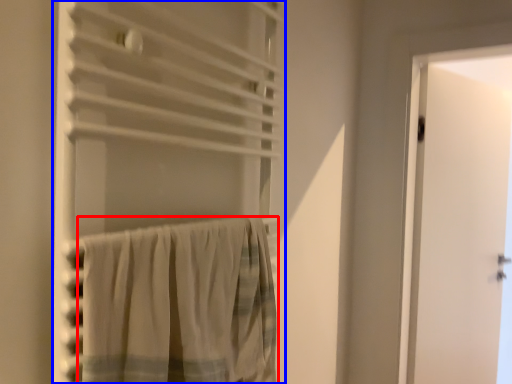
Question: Which object appears farthest to the camera in this image, curtain (highlighted by a red box) or curtain (highlighted by a blue box)?

Choices:
 (A) curtain
 (B) curtain

Answer: (A)